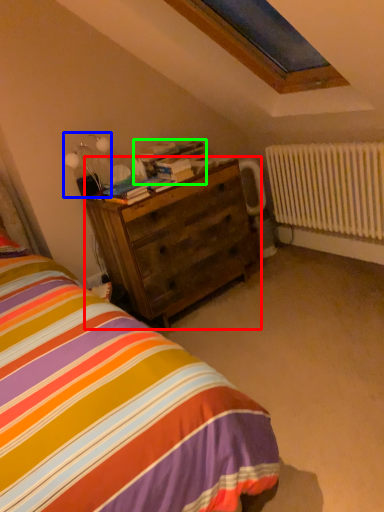
Question: Considering the real-world distances, which object is farthest from chest of drawers (highlighted by a red box)? table lamp (highlighted by a blue box) or book (highlighted by a green box)?

Choices:
 (A) table lamp
 (B) book

Answer: (A)